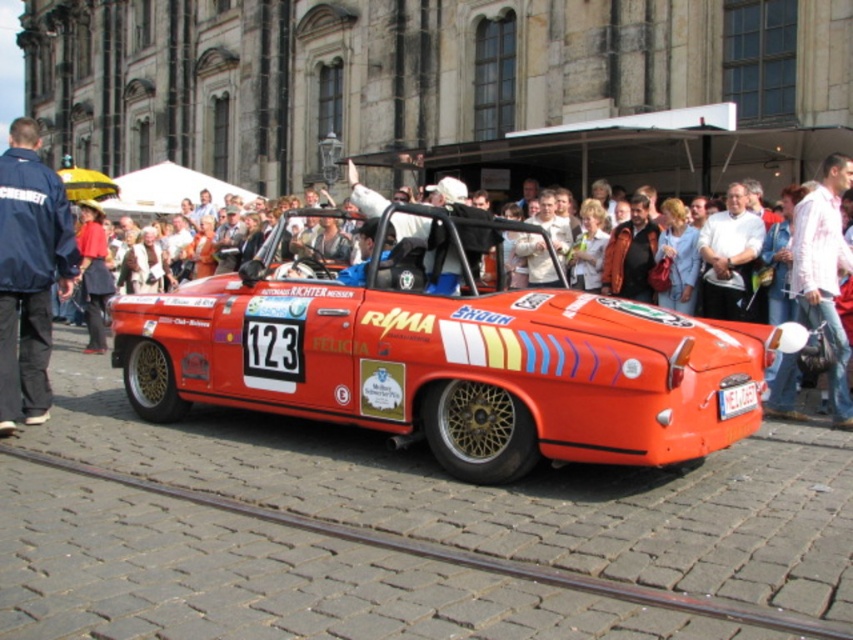
Based on the photo, is shiny orange car at center taller than blue jacket at left?

→ No.

Based on the photo, which is more to the left, shiny orange car at center or blue jacket at left?

From the viewer's perspective, blue jacket at left appears more on the left side.

Is point (410, 316) positioned in front of point (0, 324)?

Yes, it is in front of point (0, 324).

I want to click on shiny orange car at center, so click(x=442, y=364).

Is white shirt at center to the right of yellow plastic license plate at center from the viewer's perspective?

Yes, white shirt at center is to the right of yellow plastic license plate at center.

Can you confirm if white shirt at center is positioned below yellow plastic license plate at center?

Incorrect, white shirt at center is not positioned below yellow plastic license plate at center.

You are a GUI agent. You are given a task and a screenshot of the screen. Output one action in this format:
    pyautogui.click(x=<x>, y=<y>)
    Task: Click on the white shirt at center
    Image resolution: width=853 pixels, height=640 pixels.
    Given the screenshot: What is the action you would take?
    pyautogui.click(x=824, y=273)

Between blue jacket at left and yellow plastic license plate at center, which one has less height?

With less height is yellow plastic license plate at center.

Does blue jacket at left appear on the right side of yellow plastic license plate at center?

No, blue jacket at left is not to the right of yellow plastic license plate at center.

Which is in front, point (28, 312) or point (722, 406)?

Positioned in front is point (722, 406).

Locate an element on the screen. blue jacket at left is located at coordinates (28, 273).